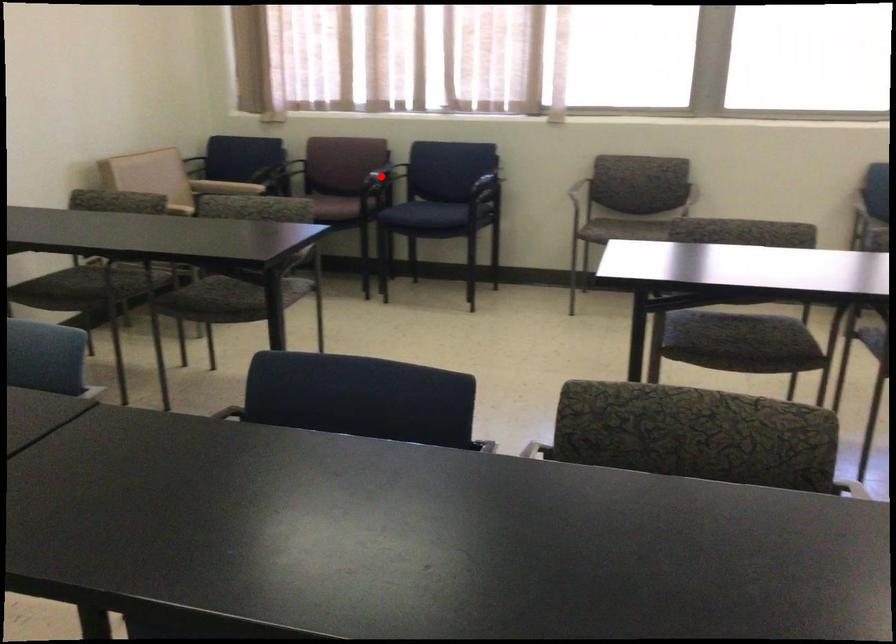
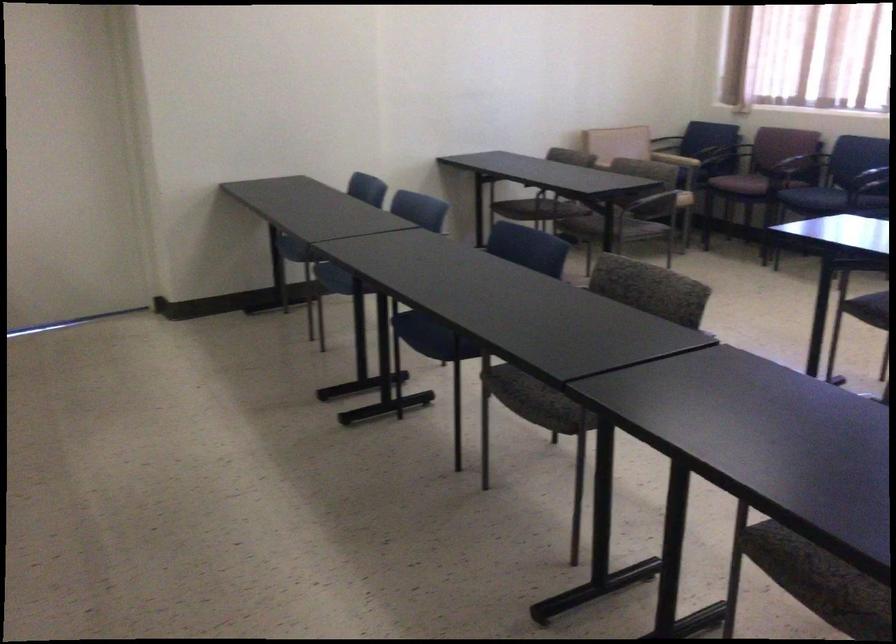
In the second image, find the point that corresponds to the highlighted location in the first image.

(800, 160)